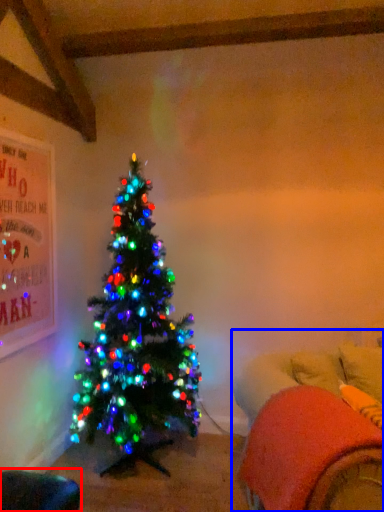
Question: Which object appears farthest to the camera in this image, bean bag chair (highlighted by a red box) or bean bag chair (highlighted by a blue box)?

Choices:
 (A) bean bag chair
 (B) bean bag chair

Answer: (A)